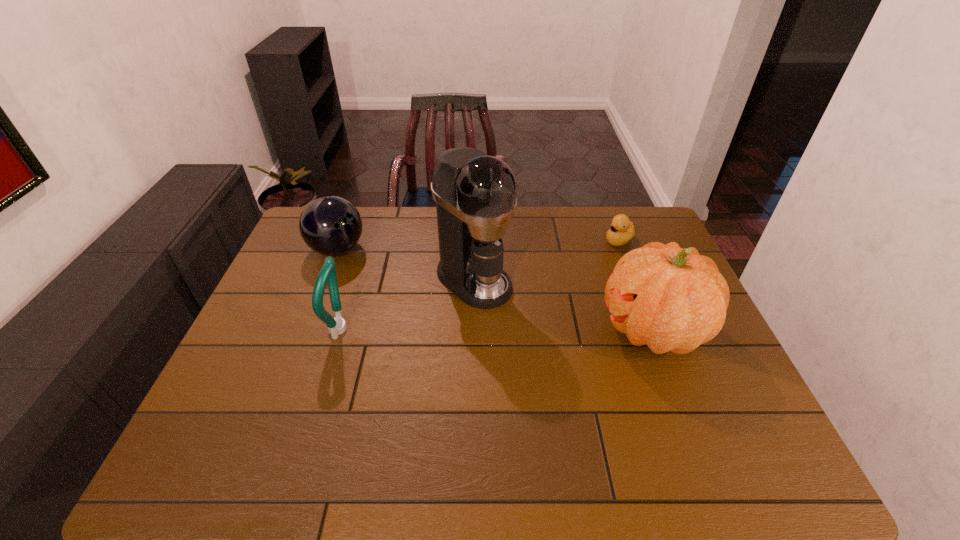
Locate an element on the screen. The width and height of the screenshot is (960, 540). vacant position in the image that satisfies the following two spatial constraints: 1. on the front side of the third shortest object; 2. at the jaws of the bowling ball is located at coordinates (307, 329).

Identify the location of vacant region that satisfies the following two spatial constraints: 1. on the back side of the coffee maker; 2. on the right side of the duckling. (474, 240).

Where is `vacant area that satisfies the following two spatial constraints: 1. on the back side of the third object from left to right; 2. on the right side of the duckling`? vacant area that satisfies the following two spatial constraints: 1. on the back side of the third object from left to right; 2. on the right side of the duckling is located at coordinates (474, 240).